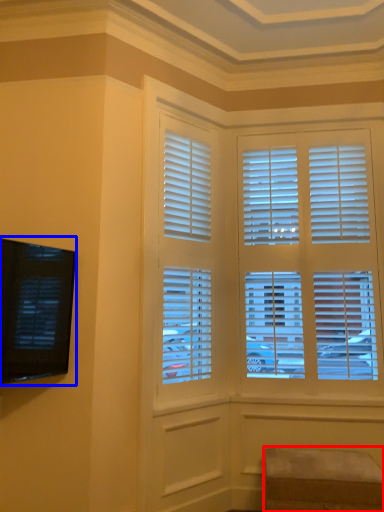
Question: Which of the following is the closest to the observer, furniture (highlighted by a red box) or window screen (highlighted by a blue box)?

Choices:
 (A) furniture
 (B) window screen

Answer: (B)